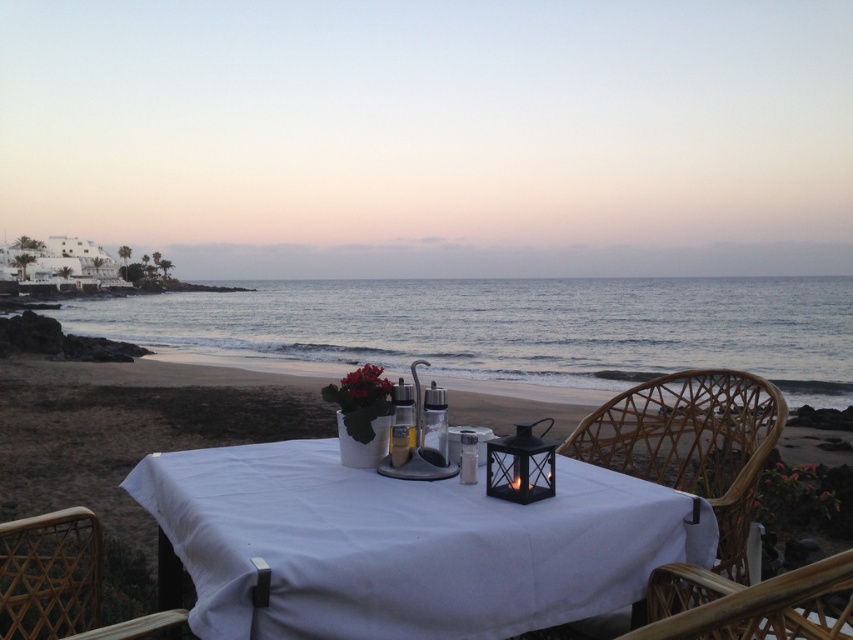
Can you confirm if white cloth-covered table at center is wider than woven rattan chair at right?

Yes, white cloth-covered table at center is wider than woven rattan chair at right.

Image resolution: width=853 pixels, height=640 pixels. What do you see at coordinates (405, 545) in the screenshot? I see `white cloth-covered table at center` at bounding box center [405, 545].

The height and width of the screenshot is (640, 853). Identify the location of white cloth-covered table at center. (405, 545).

Does woven wood chair at lower left appear on the left side of woven wood chair at center?

Indeed, woven wood chair at lower left is positioned on the left side of woven wood chair at center.

Between woven wood chair at lower left and woven wood chair at center, which one has less height?

woven wood chair at lower left is shorter.

Where is `woven wood chair at lower left`? The height and width of the screenshot is (640, 853). woven wood chair at lower left is located at coordinates (62, 582).

Based on the photo, can you confirm if white cloth-covered table at center is positioned to the right of woven wood chair at lower left?

Yes, white cloth-covered table at center is to the right of woven wood chair at lower left.

Which is behind, point (662, 545) or point (25, 604)?

Positioned behind is point (25, 604).

Does point (328, 620) come farther from viewer compared to point (30, 577)?

No.

You are a GUI agent. You are given a task and a screenshot of the screen. Output one action in this format:
    pyautogui.click(x=<x>, y=<y>)
    Task: Click on the white cloth-covered table at center
    
    Given the screenshot: What is the action you would take?
    pyautogui.click(x=405, y=545)